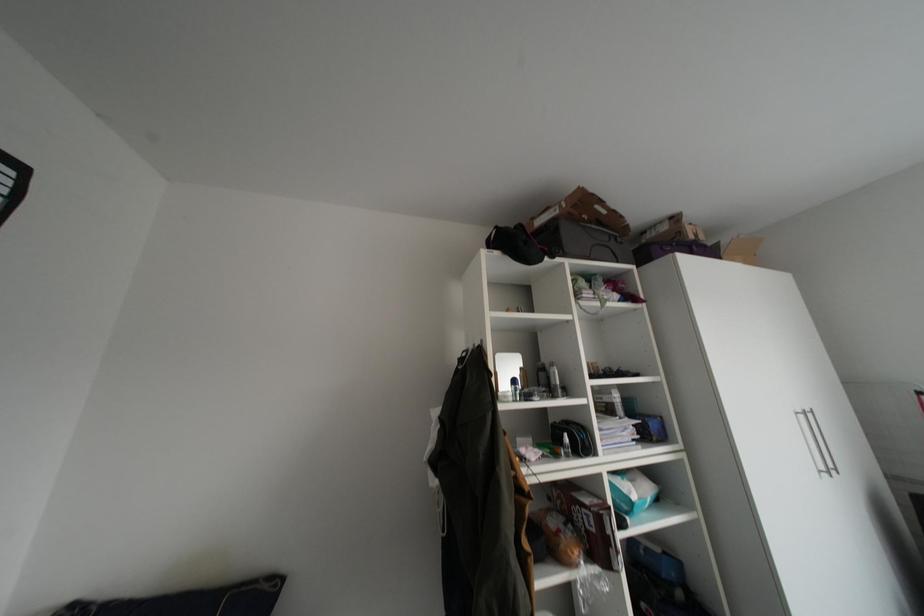
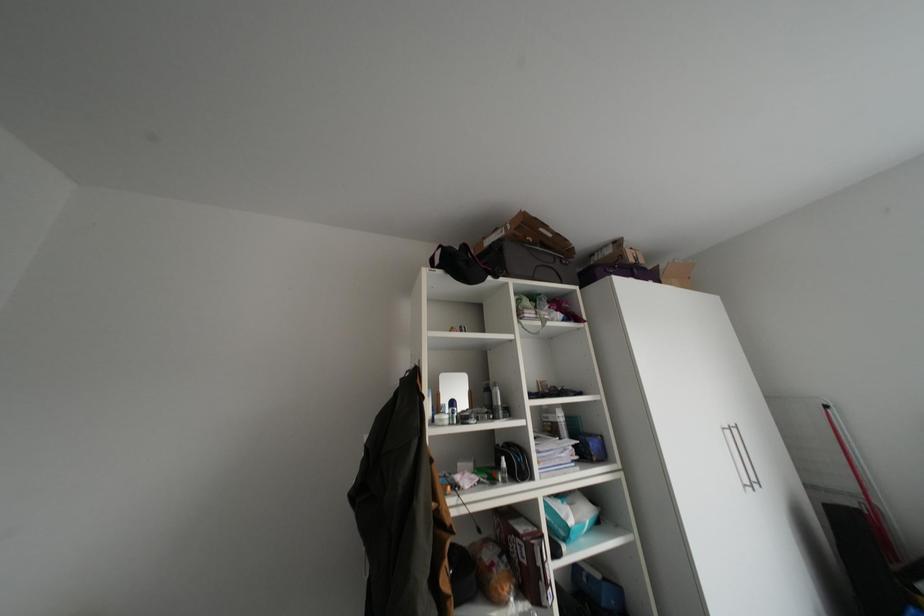
Question: The images are taken continuously from a first-person perspective. In which direction are you moving?

Choices:
 (A) Left
 (B) Right
 (C) Forward
 (D) Backward

Answer: (B)